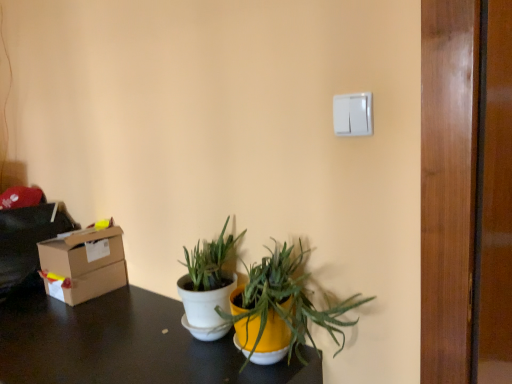
Locate an element on the screen. Image resolution: width=512 pixels, height=384 pixels. free point in front of white matte pot at center, the 2th houseplant in the right-to-left sequence is located at coordinates (180, 362).